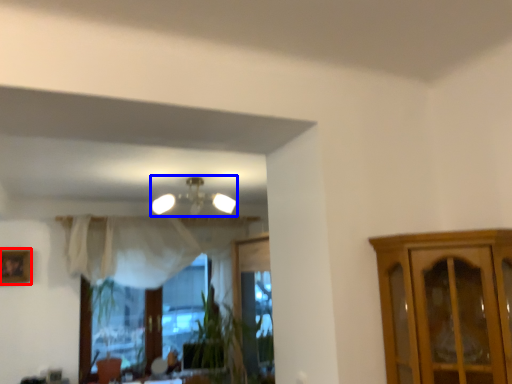
Question: Which object is further to the camera taking this photo, picture frame (highlighted by a red box) or lamp (highlighted by a blue box)?

Choices:
 (A) picture frame
 (B) lamp

Answer: (A)